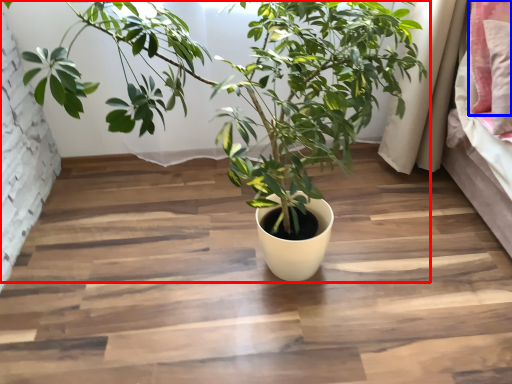
Question: Which object is closer to the camera taking this photo, houseplant (highlighted by a red box) or pillow (highlighted by a blue box)?

Choices:
 (A) houseplant
 (B) pillow

Answer: (A)